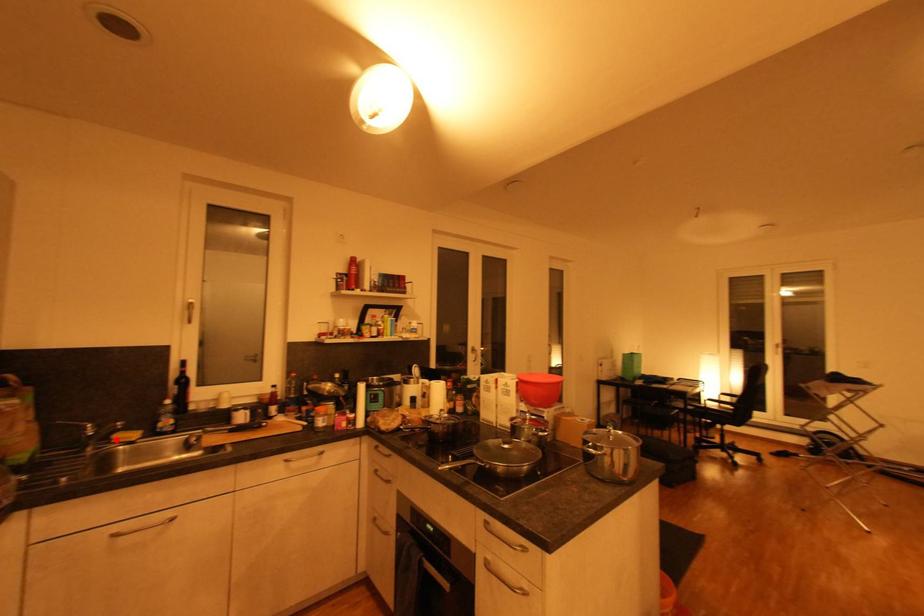
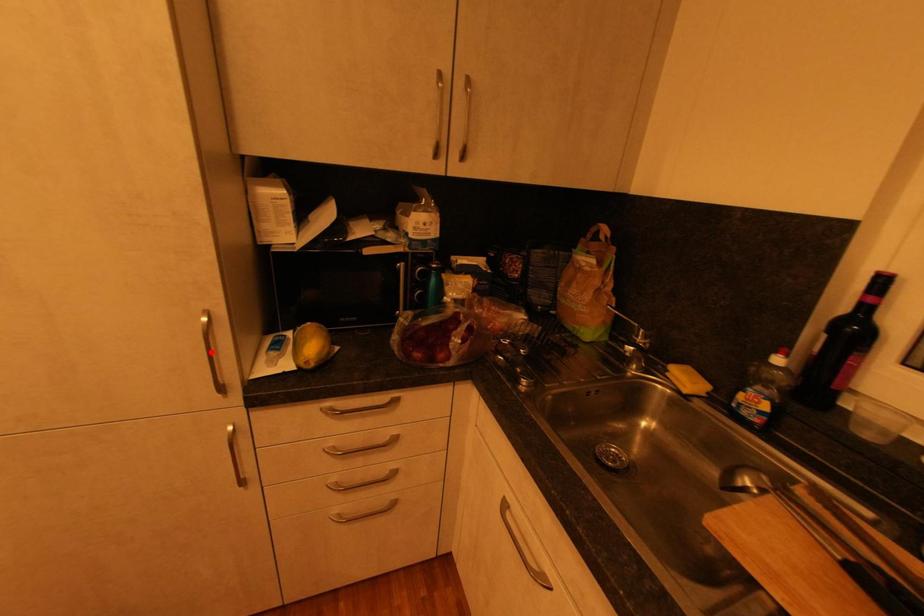
Looking at this image, I am providing you with two images of the same scene from different viewpoints. A red point is marked on the first image and another point is marked on the second image. Is the red point in image1 aligned with the point shown in image2?

No